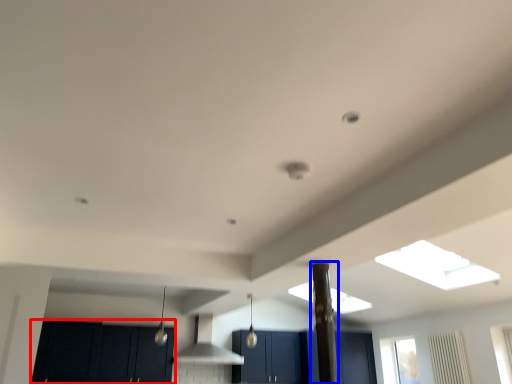
Question: Among these objects, which one is farthest to the camera, cabinetry (highlighted by a red box) or pillar (highlighted by a blue box)?

Choices:
 (A) cabinetry
 (B) pillar

Answer: (A)